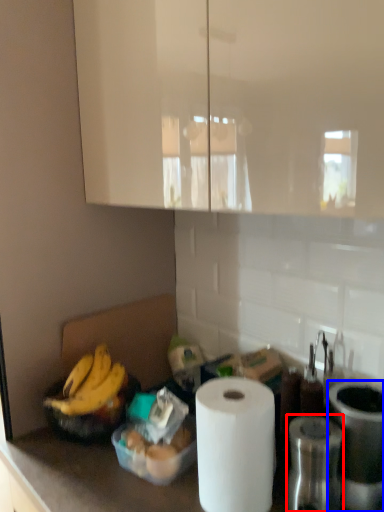
Question: Which object is further to the camera taking this photo, appliance (highlighted by a red box) or appliance (highlighted by a blue box)?

Choices:
 (A) appliance
 (B) appliance

Answer: (B)